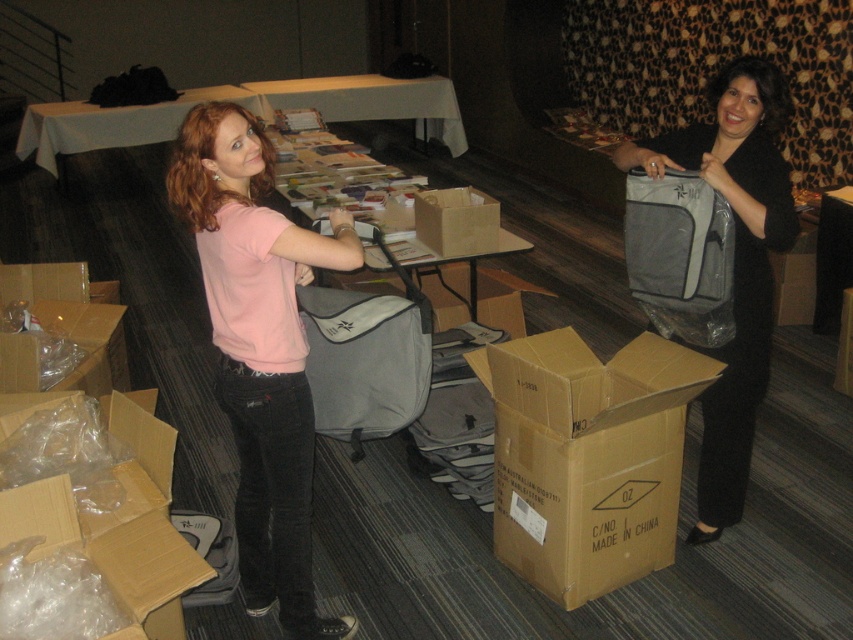
You are a security guard checking the height of items in the conference room. You see the pink cotton shirt at center and the matte gray backpack at lower left. Which item is taller?

The pink cotton shirt at center is taller than the matte gray backpack at lower left according to the description.

You are moving a large gray bag to the brown cardboard box at lower center. What are the coordinates of the box you need to aim for?

The brown cardboard box at lower center is located at coordinates point [587,456], so aim for that point.